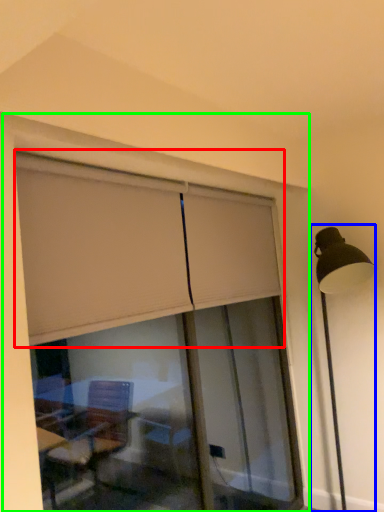
Question: Considering the real-world distances, which object is farthest from curtain (highlighted by a red box)? lamp post (highlighted by a blue box) or window frame (highlighted by a green box)?

Choices:
 (A) lamp post
 (B) window frame

Answer: (A)